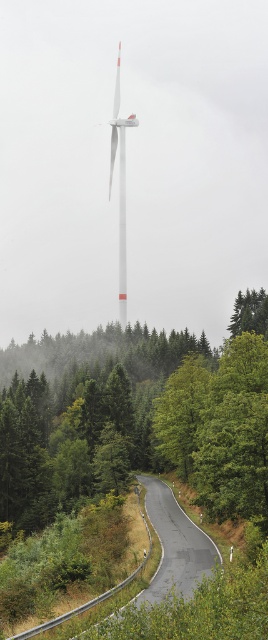
You are standing on the asphalt road at center and want to walk towards the white matte wind turbine at center. Which direction should you walk to get closer to the turbine?

Since the asphalt road at center is closer to the viewer than the white matte wind turbine at center, you should walk forward along the asphalt road at center towards the direction where the road curves gently to the left to approach the turbine.

From the picture: You are driving along the curving road and notice a green matte tree at center and a white matte wind turbine at center in the distance. Which object is closer to you?

The green matte tree at center is closer to the viewer than the white matte wind turbine at center.

You are standing at the starting point of the curving road in the rural landscape. You see two points marked on the road ahead. The first point is at coordinate point(165, 515) and the second is at point(251, 305). Which point is closer to you as you stand at the starting point?

Point(165, 515) is closer to the viewer than point(251, 305), so the first point is closer to you.